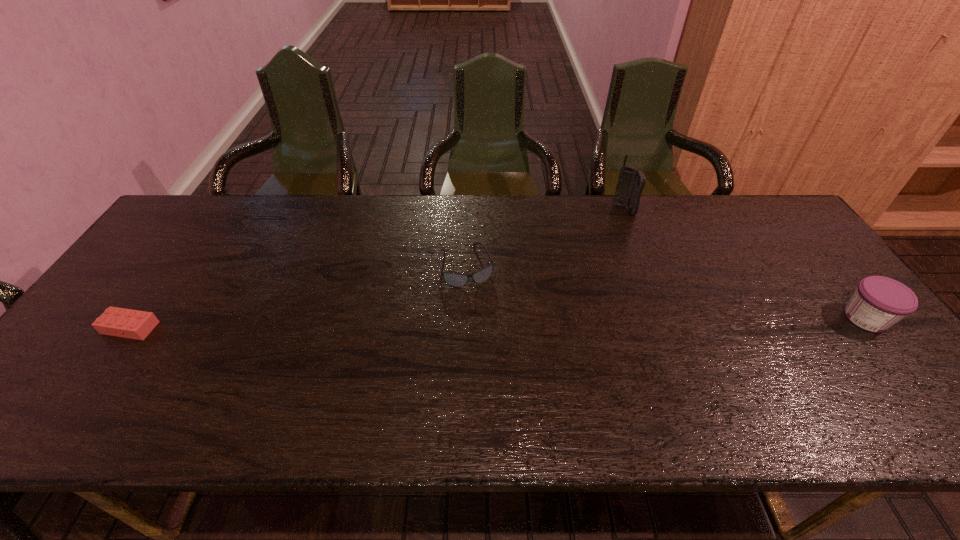
Where is `Lego`? Lego is located at coordinates (134, 324).

Locate an element on the screen. This screenshot has width=960, height=540. the shortest object is located at coordinates (134, 324).

Find the location of `jam`. jam is located at coordinates (878, 303).

At what (x,y) coordinates should I click in order to perform the action: click on the rightmost object. Please return your answer as a coordinate pair (x, y). Looking at the image, I should click on (878, 303).

In order to click on the third object from right to left in this screenshot , I will do `click(453, 279)`.

Find the location of a particular element. the third nearest object is located at coordinates (453, 279).

This screenshot has height=540, width=960. In order to click on the third object from left to right in this screenshot , I will do `click(631, 182)`.

The image size is (960, 540). Identify the location of the farthest object. (631, 182).

You are a GUI agent. You are given a task and a screenshot of the screen. Output one action in this format:
    pyautogui.click(x=<x>, y=<y>)
    Task: Click on the free space located on the back of the leftmost object
    The image size is (960, 540).
    Given the screenshot: What is the action you would take?
    pyautogui.click(x=202, y=228)

This screenshot has height=540, width=960. In order to click on free region located 0.080m on the lenses of the second object from left to right in this screenshot , I will do `click(479, 309)`.